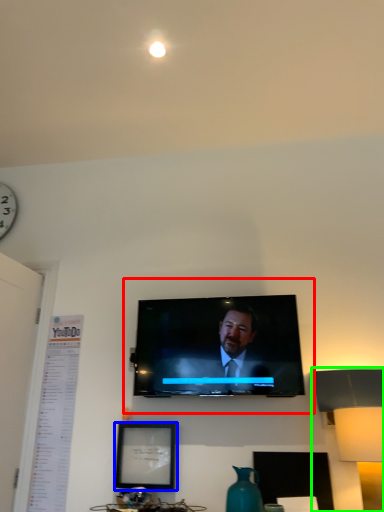
Question: Which object is the closest to the tv show (highlighted by a red box)? Choose among these: picture frame (highlighted by a blue box) or table lamp (highlighted by a green box).

Choices:
 (A) picture frame
 (B) table lamp

Answer: (A)